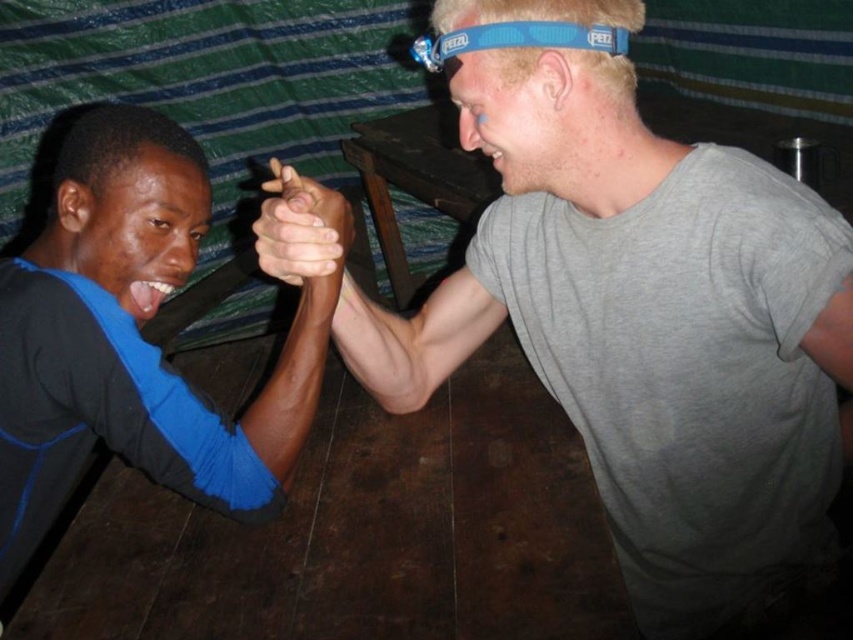
Can you confirm if blue fabric shirt at left is bigger than smooth skin hands at center?

Indeed, blue fabric shirt at left has a larger size compared to smooth skin hands at center.

Does point (1, 502) come farther from viewer compared to point (329, 211)?

Yes, it is.

The image size is (853, 640). I want to click on blue fabric shirt at left, so click(x=131, y=339).

Measure the distance between blue fabric shirt at left and blue rubber headband at upper center.

A distance of 23.56 inches exists between blue fabric shirt at left and blue rubber headband at upper center.

Who is more distant from viewer, (131, 220) or (422, 52)?

Positioned behind is point (131, 220).

Find the location of a particular element. blue fabric shirt at left is located at coordinates (131, 339).

This screenshot has width=853, height=640. I want to click on blue fabric shirt at left, so click(x=131, y=339).

In the scene shown: Is gray matte t-shirt at center in front of blue fabric shirt at left?

Yes, it is.

Which of these two, gray matte t-shirt at center or blue fabric shirt at left, stands taller?

Standing taller between the two is gray matte t-shirt at center.

Is point (640, 24) positioned before point (247, 413)?

Yes, it is in front of point (247, 413).

Locate an element on the screen. This screenshot has width=853, height=640. gray matte t-shirt at center is located at coordinates (645, 326).